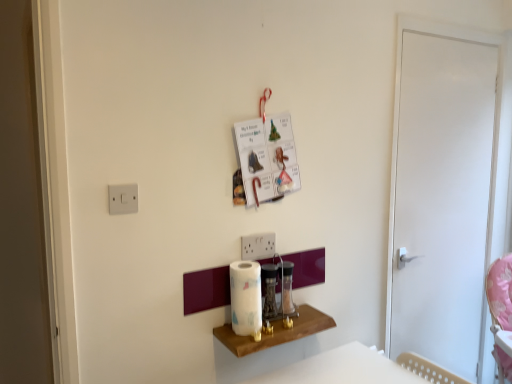
Where is `vacant space to the right of clear glass jar at center, which is counted as the 1th appliance, starting from the right`? The image size is (512, 384). vacant space to the right of clear glass jar at center, which is counted as the 1th appliance, starting from the right is located at coordinates (311, 316).